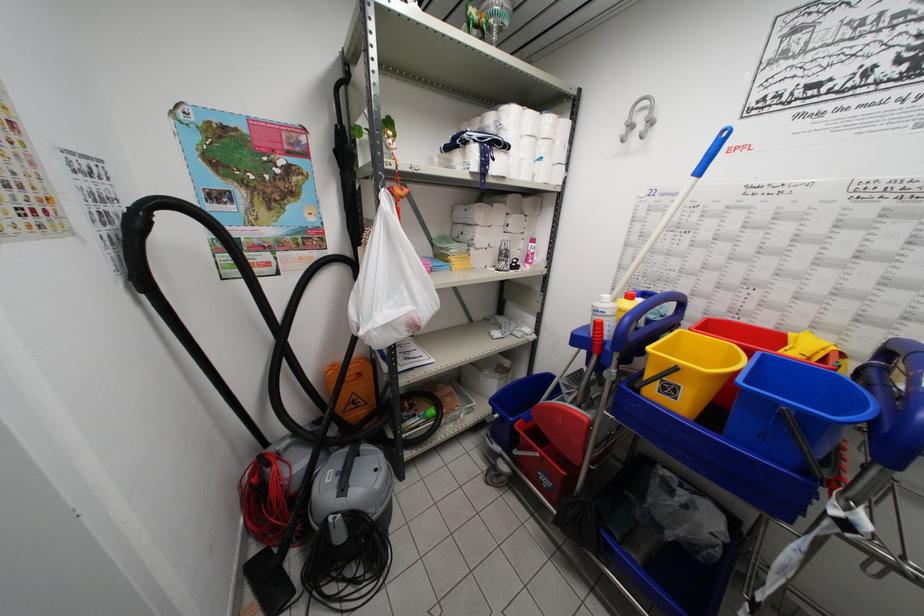
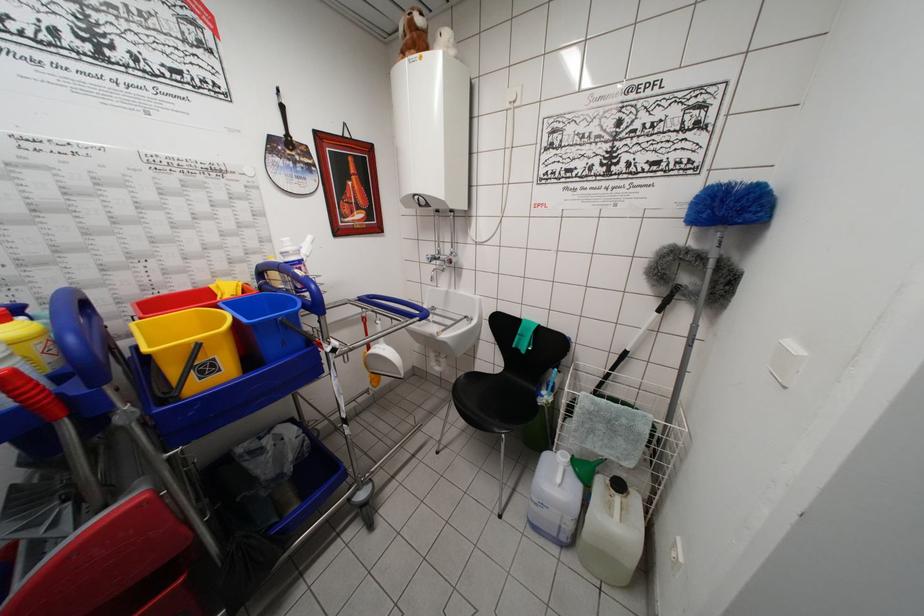
Where in the second image is the point corresponding to (x=679, y=371) from the first image?

(200, 349)